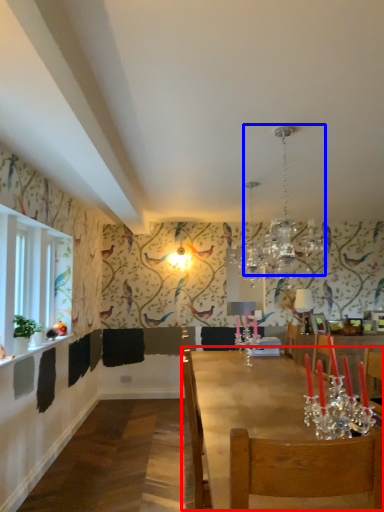
Question: Which object is further to the camera taking this photo, table (highlighted by a red box) or light fixture (highlighted by a blue box)?

Choices:
 (A) table
 (B) light fixture

Answer: (B)